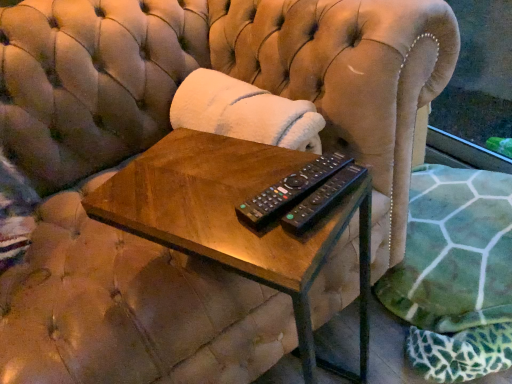
What is the approximate height of black plastic remote at center, the first remote control from the back?

The height of black plastic remote at center, the first remote control from the back, is 0.78 inches.

The image size is (512, 384). In order to click on black plastic remote at center, the first remote control positioned from the front in this screenshot , I will do pos(322,200).

Image resolution: width=512 pixels, height=384 pixels. Describe the element at coordinates (234, 221) in the screenshot. I see `woodenmaterial/texturetable at center` at that location.

Where is `black plastic remote at center, the first remote control from the back`? The width and height of the screenshot is (512, 384). black plastic remote at center, the first remote control from the back is located at coordinates (290, 189).

Which object is closer to the camera, black plastic remote at center, the first remote control positioned from the front, or black plastic remote at center, which appears as the 2th remote control when viewed from the front?

black plastic remote at center, the first remote control positioned from the front, is closer to the camera.

Is point (348, 169) in front of point (272, 192)?

No, (348, 169) is behind (272, 192).

Considering the sizes of objects black plastic remote at center, the first remote control positioned from the front, and black plastic remote at center, which appears as the 2th remote control when viewed from the front, in the image provided, who is wider, black plastic remote at center, the first remote control positioned from the front, or black plastic remote at center, which appears as the 2th remote control when viewed from the front,?

black plastic remote at center, which appears as the 2th remote control when viewed from the front.

Could you measure the distance between black plastic remote at center, the second remote control viewed from the back, and black plastic remote at center, the first remote control from the back?

They are 1.31 inches apart.

Based on their positions, is black plastic remote at center, the first remote control from the back, located to the left or right of black plastic remote at center, the first remote control positioned from the front?

In the image, black plastic remote at center, the first remote control from the back, appears on the left side of black plastic remote at center, the first remote control positioned from the front.

From the image's perspective, is black plastic remote at center, which appears as the 2th remote control when viewed from the front, above black plastic remote at center, the second remote control viewed from the back?

Yes, from the image's perspective, black plastic remote at center, which appears as the 2th remote control when viewed from the front, is on top of black plastic remote at center, the second remote control viewed from the back.

Considering the relative sizes of black plastic remote at center, which appears as the 2th remote control when viewed from the front, and black plastic remote at center, the first remote control positioned from the front, in the image provided, is black plastic remote at center, which appears as the 2th remote control when viewed from the front, bigger than black plastic remote at center, the first remote control positioned from the front,?

Correct, black plastic remote at center, which appears as the 2th remote control when viewed from the front, is larger in size than black plastic remote at center, the first remote control positioned from the front.

Between black plastic remote at center, which appears as the 2th remote control when viewed from the front, and black plastic remote at center, the first remote control positioned from the front, which one is positioned in front?

black plastic remote at center, the first remote control positioned from the front, is in front.

Visually, is woodenmaterial/texturetable at center positioned to the left or to the right of black plastic remote at center, the second remote control viewed from the back?

woodenmaterial/texturetable at center is positioned on black plastic remote at center, the second remote control viewed from the back,'s left side.

From the image's perspective, does woodenmaterial/texturetable at center appear lower than black plastic remote at center, the second remote control viewed from the back?

Indeed, from the image's perspective, woodenmaterial/texturetable at center is shown beneath black plastic remote at center, the second remote control viewed from the back.

Which object is thinner, woodenmaterial/texturetable at center or black plastic remote at center, the second remote control viewed from the back?

With smaller width is black plastic remote at center, the second remote control viewed from the back.

Between woodenmaterial/texturetable at center and black plastic remote at center, the first remote control positioned from the front, which one has larger size?

With larger size is woodenmaterial/texturetable at center.

From a real-world perspective, is black plastic remote at center, the second remote control viewed from the back, physically located above or below woodenmaterial/texturetable at center?

black plastic remote at center, the second remote control viewed from the back, is above woodenmaterial/texturetable at center.

Is woodenmaterial/texturetable at center a part of black plastic remote at center, the second remote control viewed from the back?

Actually, woodenmaterial/texturetable at center is outside black plastic remote at center, the second remote control viewed from the back.

In terms of size, does black plastic remote at center, the first remote control positioned from the front, appear bigger or smaller than woodenmaterial/texturetable at center?

In the image, black plastic remote at center, the first remote control positioned from the front, appears to be smaller than woodenmaterial/texturetable at center.

Find the location of a particular element. This screenshot has height=384, width=512. table below the black plastic remote at center, the second remote control viewed from the back (from a real-world perspective) is located at coordinates (234, 221).

From the image's perspective, is black plastic remote at center, the first remote control from the back, located beneath woodenmaterial/texturetable at center?

Incorrect, from the image's perspective, black plastic remote at center, the first remote control from the back, is higher than woodenmaterial/texturetable at center.

Are black plastic remote at center, which appears as the 2th remote control when viewed from the front, and woodenmaterial/texturetable at center located far from each other?

No, black plastic remote at center, which appears as the 2th remote control when viewed from the front, is not far from woodenmaterial/texturetable at center.

The image size is (512, 384). I want to click on table that appears below the black plastic remote at center, the first remote control from the back (from the image's perspective), so click(x=234, y=221).

Considering the relative positions of woodenmaterial/texturetable at center and black plastic remote at center, the first remote control from the back, in the image provided, is woodenmaterial/texturetable at center to the left of black plastic remote at center, the first remote control from the back, from the viewer's perspective?

Correct, you'll find woodenmaterial/texturetable at center to the left of black plastic remote at center, the first remote control from the back.

Is point (258, 257) positioned in front of point (262, 204)?

Yes.

Is woodenmaterial/texturetable at center turned away from black plastic remote at center, which appears as the 2th remote control when viewed from the front?

That's not correct — woodenmaterial/texturetable at center is not looking away from black plastic remote at center, which appears as the 2th remote control when viewed from the front.

Considering the sizes of woodenmaterial/texturetable at center and black plastic remote at center, which appears as the 2th remote control when viewed from the front, in the image, is woodenmaterial/texturetable at center taller or shorter than black plastic remote at center, which appears as the 2th remote control when viewed from the front,?

In the image, woodenmaterial/texturetable at center appears to be taller than black plastic remote at center, which appears as the 2th remote control when viewed from the front.

You are a GUI agent. You are given a task and a screenshot of the screen. Output one action in this format:
    pyautogui.click(x=<x>, y=<y>)
    Task: Click on the remote control on the left of the black plastic remote at center, the first remote control positioned from the front
    The image size is (512, 384).
    Given the screenshot: What is the action you would take?
    pyautogui.click(x=290, y=189)

Find the location of `remote control below the black plastic remote at center, the second remote control viewed from the back (from a real-world perspective)`. remote control below the black plastic remote at center, the second remote control viewed from the back (from a real-world perspective) is located at coordinates (290, 189).

Looking at the image, which one is located closer to woodenmaterial/texturetable at center, black plastic remote at center, the second remote control viewed from the back, or black plastic remote at center, the first remote control from the back?

The object closer to woodenmaterial/texturetable at center is black plastic remote at center, the first remote control from the back.

Based on their spatial positions, is black plastic remote at center, the first remote control positioned from the front, or woodenmaterial/texturetable at center closer to black plastic remote at center, which appears as the 2th remote control when viewed from the front?

Based on the image, black plastic remote at center, the first remote control positioned from the front, appears to be nearer to black plastic remote at center, which appears as the 2th remote control when viewed from the front.

From the image, which object appears to be nearer to black plastic remote at center, the first remote control from the back, woodenmaterial/texturetable at center or black plastic remote at center, the first remote control positioned from the front?

black plastic remote at center, the first remote control positioned from the front, is positioned closer to the anchor black plastic remote at center, the first remote control from the back.

Based on the photo, when comparing their distances from black plastic remote at center, the first remote control positioned from the front, does woodenmaterial/texturetable at center or black plastic remote at center, which appears as the 2th remote control when viewed from the front, seem closer?

black plastic remote at center, which appears as the 2th remote control when viewed from the front.

Considering their positions, is black plastic remote at center, which appears as the 2th remote control when viewed from the front, positioned further to woodenmaterial/texturetable at center than black plastic remote at center, the first remote control positioned from the front?

The object further to woodenmaterial/texturetable at center is black plastic remote at center, the first remote control positioned from the front.

Looking at the image, which one is located closer to black plastic remote at center, the first remote control positioned from the front, black plastic remote at center, the first remote control from the back, or woodenmaterial/texturetable at center?

black plastic remote at center, the first remote control from the back.

What are the coordinates of `remote control between black plastic remote at center, the first remote control from the back, and woodenmaterial/texturetable at center in the up-down direction` in the screenshot? It's located at (322, 200).